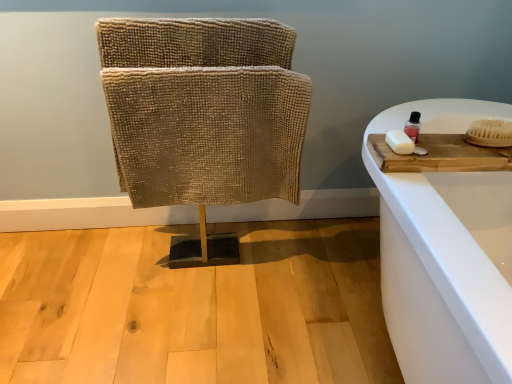
At what (x,y) coordinates should I click in order to perform the action: click on free space in front of beige textured fabric at center. Please return your answer as a coordinate pair (x, y). Image resolution: width=512 pixels, height=384 pixels. Looking at the image, I should click on (198, 321).